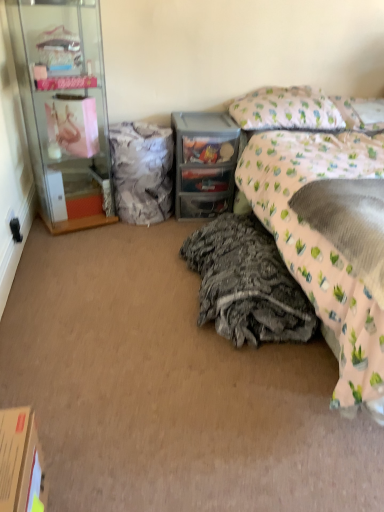
Locate an element on the screen. This screenshot has width=384, height=512. free space to the back side of cardboard box at lower left is located at coordinates (70, 458).